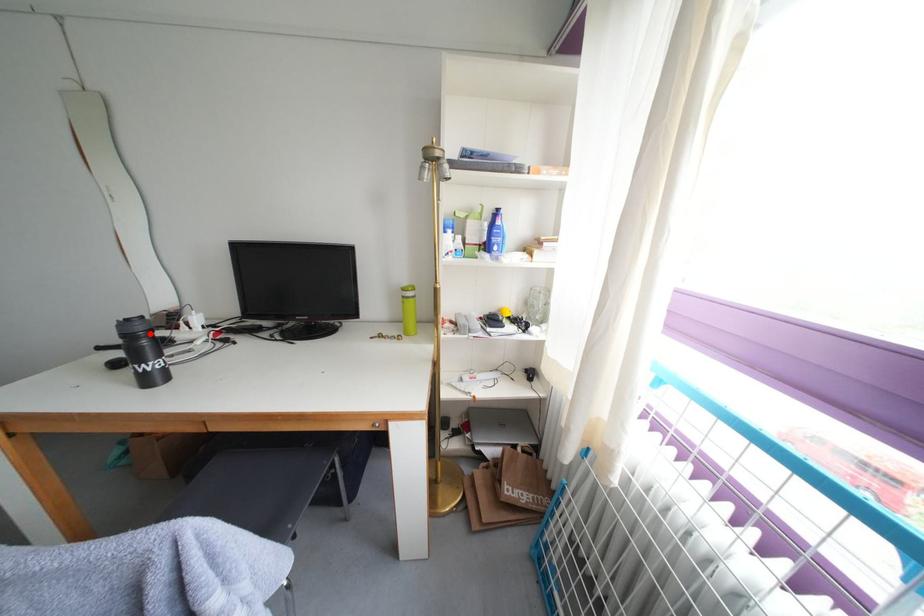
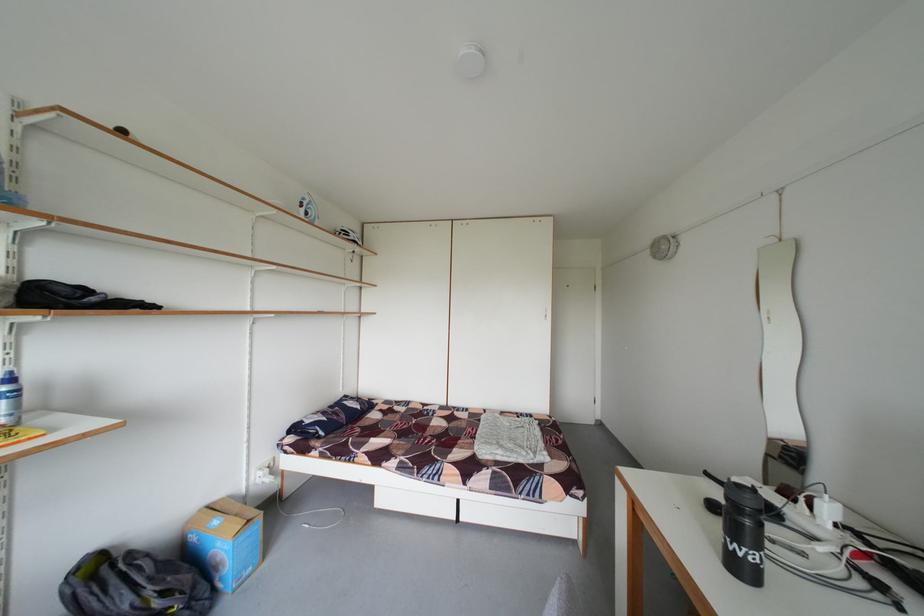
Question: I am providing you with two images of the same scene from different viewpoints. A red point is marked on the first image. Can you still see the location of the red point in image 2?

Choices:
 (A) Yes
 (B) No

Answer: (A)